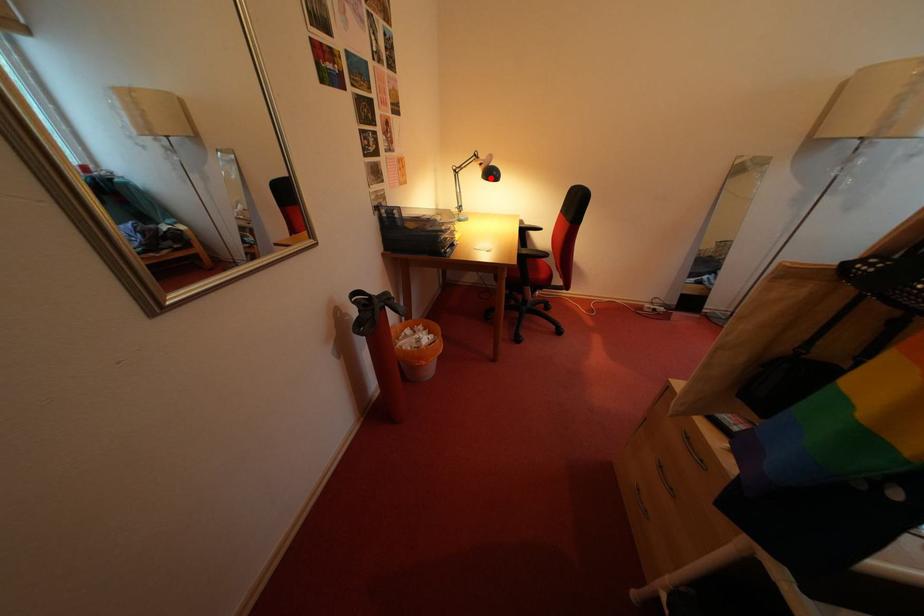
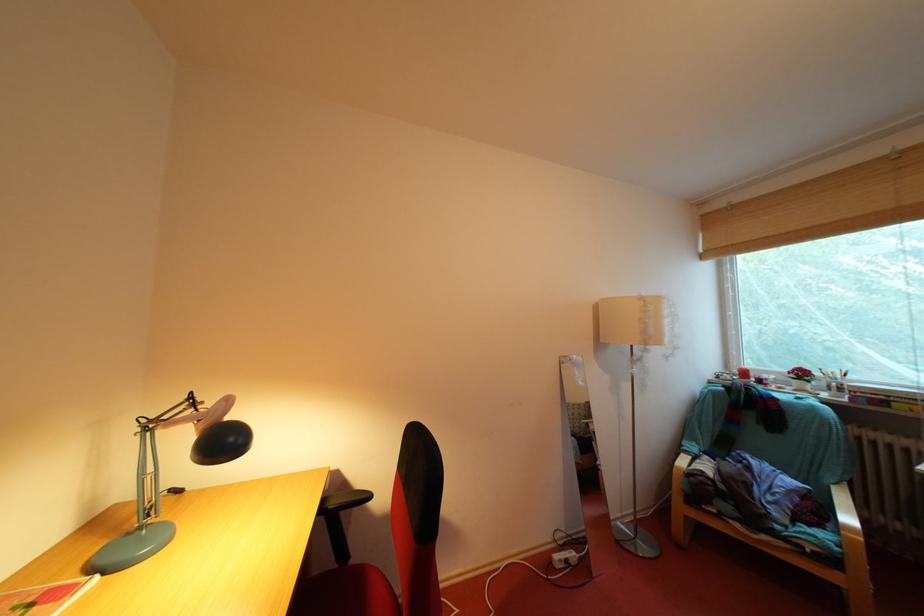
Question: I am providing you with two images of the same scene from different viewpoints. Given a red point in image1, look at the same physical point in image2. Is it:

Choices:
 (A) Closer to the viewpoint
 (B) Farther from the viewpoint

Answer: (B)